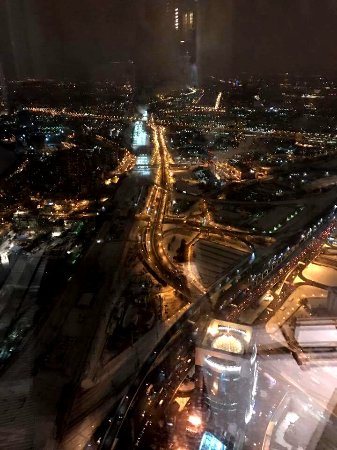
Find the location of a particular element. The height and width of the screenshot is (450, 337). blue lights is located at coordinates (214, 445).